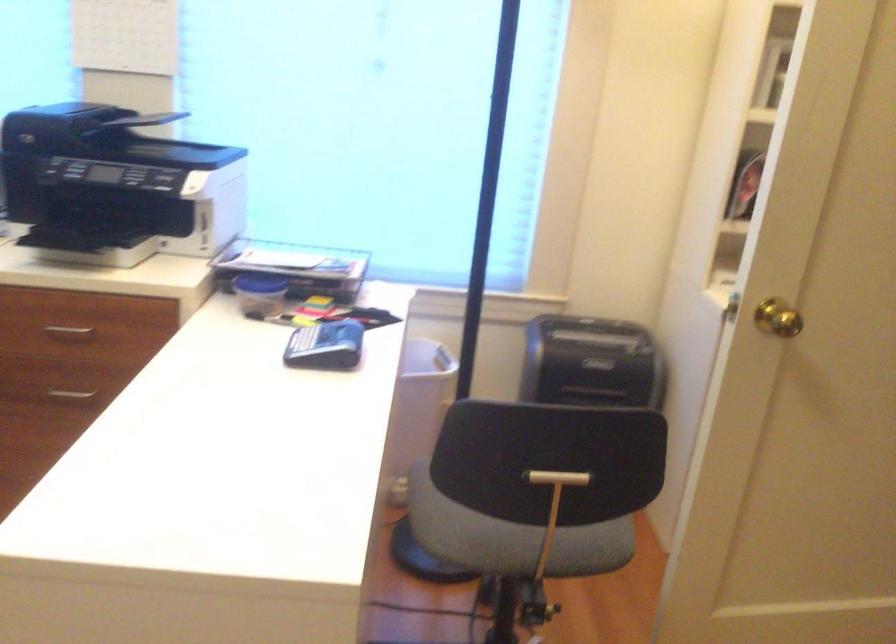
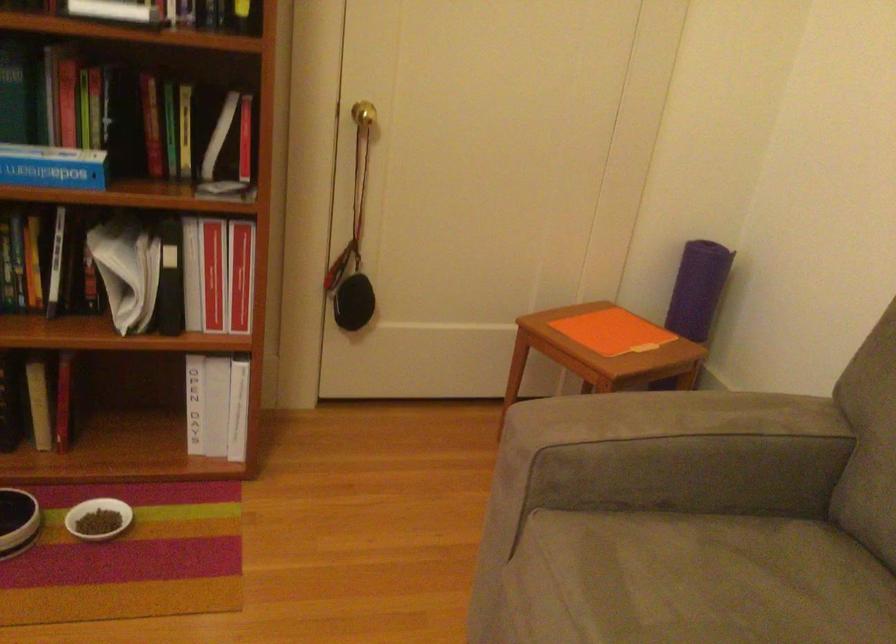
The images are taken continuously from a first-person perspective. In which direction is your viewpoint rotating?

The camera's rotation is toward right-down.